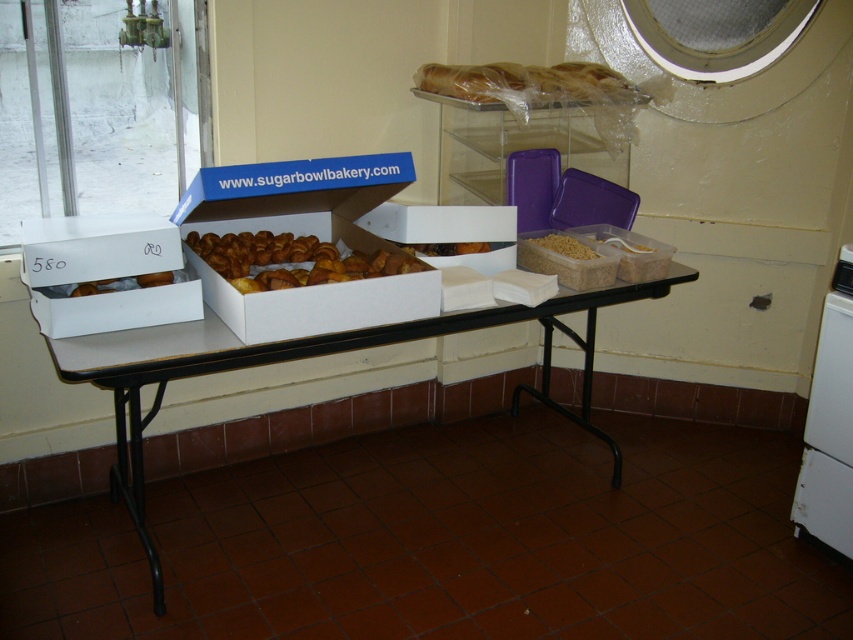
You are a customer at Sugarbowl Bakery and you want to place an order for the brown matte pasta at center. However, you need to ensure it won not spill onto the white cardboard boxes at center. Based on the scene description, can you determine if the pasta is placed above or below the boxes?

The white cardboard boxes at center is positioned under brown matte pasta at center, meaning the pasta is placed above the boxes. Therefore, it won not spill onto the boxes.

You are a delivery person who needs to place a new order of brown matte pasta at center into the white cardboard box at left. Given that the delivery cart is 4 feet wide, can you move the pasta and box closer together to load them onto the cart without moving the cart?

The white cardboard box at left and brown matte pasta at center are 3.80 feet apart, which is less than the 4 feet width of the delivery cart. Therefore, you can move the pasta and box closer together to fit them onto the cart without moving it.

You are standing in the bakery and want to place a new pastry box on the table. The new box requires 6 feet of space from the viewer to be accessible. Can you place it near the existing white cardboard boxes at center?

The white cardboard boxes at center are currently 5.76 feet away from the viewer, which is less than the required 6 feet. Therefore, placing the new box near them would not meet the 6 feet accessibility requirement.